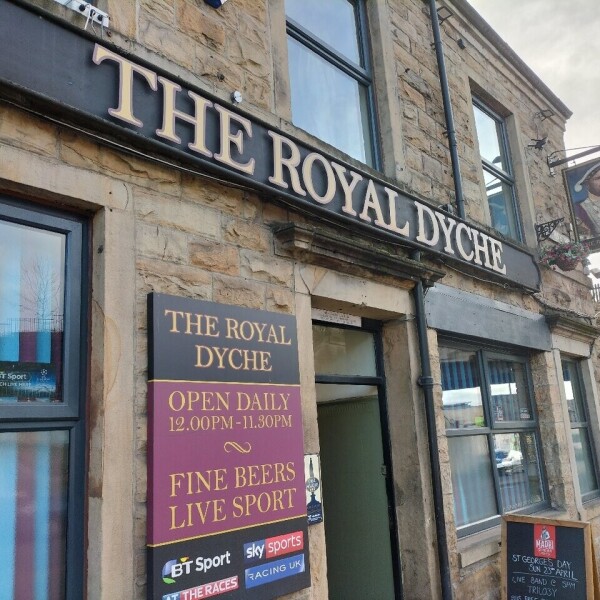
You are a GUI agent. You are given a task and a screenshot of the screen. Output one action in this format:
    pyautogui.click(x=<x>, y=<y>)
    Task: Click on the curtains
    This screenshot has width=600, height=600.
    Given the screenshot: What is the action you would take?
    pyautogui.click(x=466, y=453), pyautogui.click(x=49, y=501), pyautogui.click(x=579, y=451)